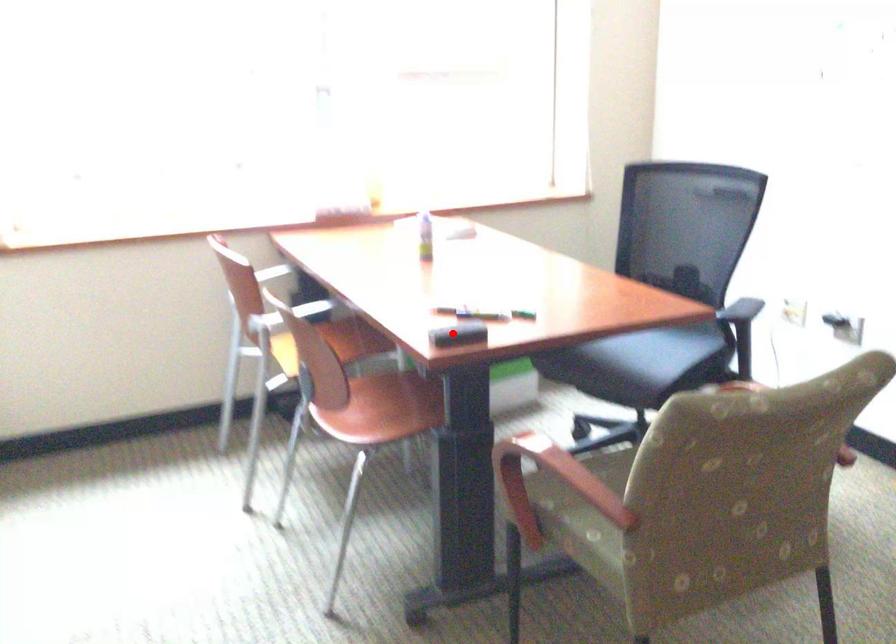
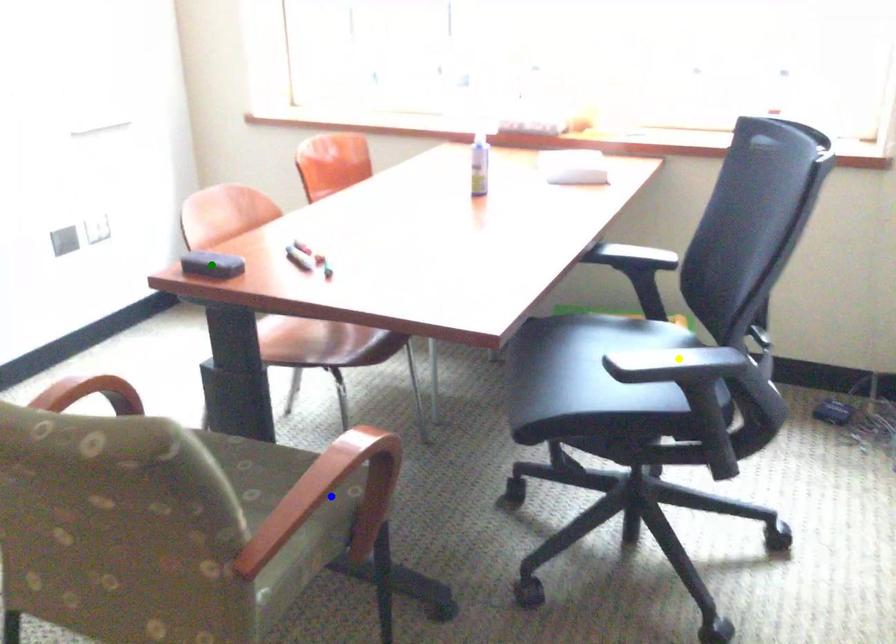
Question: I am providing you with two images of the same scene from different viewpoints. A red point is marked on the first image. You are given multiple points on the second image. Can you choose the point in image 2 that corresponds to the point in image 1?

Choices:
 (A) yellow point
 (B) green point
 (C) blue point

Answer: (B)